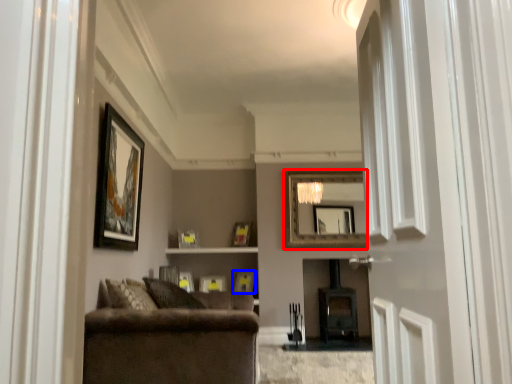
Question: Among these objects, which one is farthest to the camera, mirror (highlighted by a red box) or picture frame (highlighted by a blue box)?

Choices:
 (A) mirror
 (B) picture frame

Answer: (A)